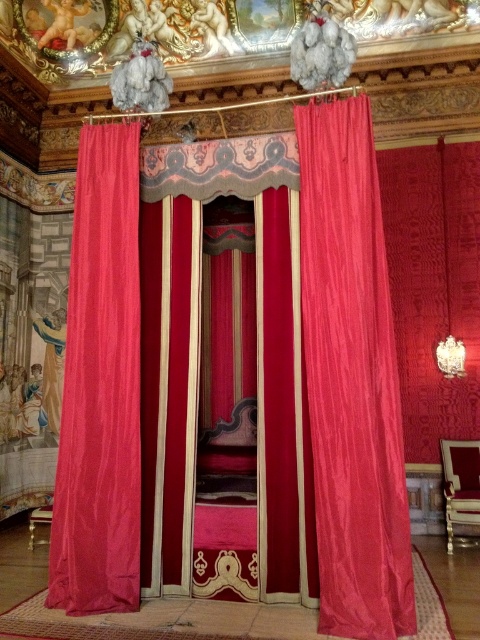
In the scene shown: You are standing in the room and want to reach both points marked in the image. Which point, point (241,518) or point (402,525), is closer to you?

Point (241,518) is closer to you because it is further to the camera than point (402,525).

You are an interior designer planning to place a large sculpture in this room. The sculpture requires a space that is larger than the velvet pink curtain at center. Based on the scene, is there enough space near the velvet bed at center to accommodate the sculpture?

The velvet bed at center is larger in size than the velvet pink curtain at center. Since the sculpture requires a space larger than the curtain, the area near the velvet bed at center likely has sufficient space as the bed itself occupies a larger area, indicating there might be enough room for the sculpture.

You are an interior designer planning to place a 20 inch wide decorative sculpture between the velvet bed at center and the velvet pink curtain at center. Will there be enough space for the sculpture?

Answer: The velvet bed at center is 20.40 inches from the velvet pink curtain at center. Since the sculpture is 20 inches wide, there is enough space as 20 inches is slightly less than the 20.40 inches available.